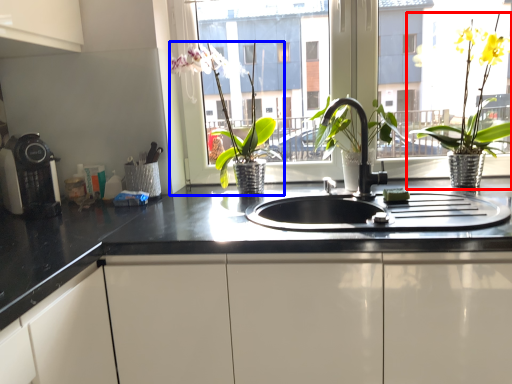
Question: Which object appears closest to the camera in this image, houseplant (highlighted by a red box) or houseplant (highlighted by a blue box)?

Choices:
 (A) houseplant
 (B) houseplant

Answer: (A)